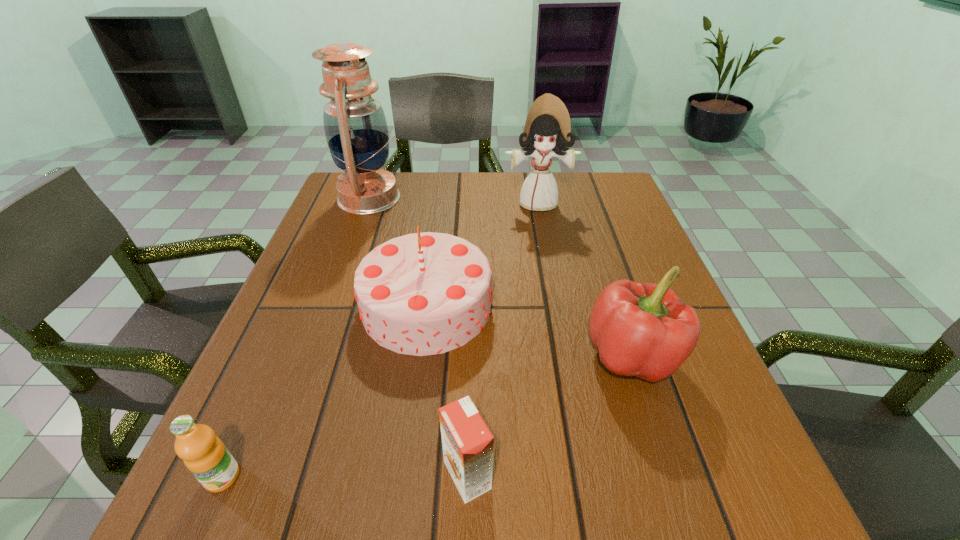
At what (x,y) coordinates should I click in order to perform the action: click on empty space between the right orange juice and the left orange juice. Please return your answer as a coordinate pair (x, y). This screenshot has height=540, width=960. Looking at the image, I should click on (345, 476).

Identify the location of free space that is in between the doll and the right orange juice. (503, 339).

Identify the location of vacant space that's between the bell pepper and the left orange juice. This screenshot has width=960, height=540. (427, 417).

Image resolution: width=960 pixels, height=540 pixels. I want to click on vacant area that lies between the left orange juice and the right orange juice, so click(x=345, y=476).

Locate which object is the fifth closest to the third shortest object. Please provide its 2D coordinates. Your answer should be formatted as a tuple, i.e. [(x, y)], where the tuple contains the x and y coordinates of a point satisfying the conditions above.

[(204, 454)]

Where is `object that stands as the fourth closest to the oil lamp`? Image resolution: width=960 pixels, height=540 pixels. object that stands as the fourth closest to the oil lamp is located at coordinates coord(204,454).

You are a GUI agent. You are given a task and a screenshot of the screen. Output one action in this format:
    pyautogui.click(x=<x>, y=<y>)
    Task: Click on the free spot that satisfies the following two spatial constraints: 1. on the front side of the fourth tallest object; 2. on the right side of the tallest object
    This screenshot has height=540, width=960.
    Given the screenshot: What is the action you would take?
    pyautogui.click(x=310, y=358)

You are a GUI agent. You are given a task and a screenshot of the screen. Output one action in this format:
    pyautogui.click(x=<x>, y=<y>)
    Task: Click on the vacant area in the image that satisfies the following two spatial constraints: 1. on the front side of the fourth shortest object; 2. on the right side of the oil lamp
    This screenshot has height=540, width=960.
    Given the screenshot: What is the action you would take?
    (329, 305)